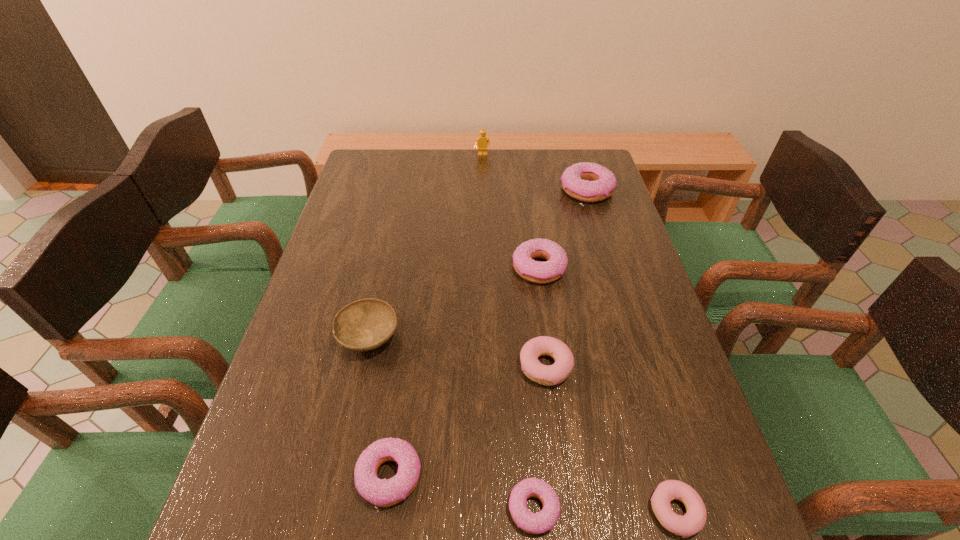
The image size is (960, 540). Find the location of `vacant space at the right edge of the desktop`. vacant space at the right edge of the desktop is located at coordinates (610, 325).

The height and width of the screenshot is (540, 960). Identify the location of free region at the far left corner of the desktop. (366, 182).

In the image, there is a desktop. Where is `vacant space at the far right corner`? This screenshot has width=960, height=540. vacant space at the far right corner is located at coordinates (597, 159).

At what (x,y) coordinates should I click in order to perform the action: click on free space between the right pink doughnut and the gray bowl. Please return your answer as a coordinate pair (x, y). The image size is (960, 540). Looking at the image, I should click on (522, 424).

Where is `free space between the second biggest purple doughnut and the farthest object`? free space between the second biggest purple doughnut and the farthest object is located at coordinates [x=511, y=211].

At what (x,y) coordinates should I click in order to perform the action: click on free spot between the leftmost purple doughnut and the third farthest object. Please return your answer as a coordinate pair (x, y). Looking at the image, I should click on (465, 372).

At what (x,y) coordinates should I click in order to perform the action: click on vacant area between the biggest purple doughnut and the third smallest purple doughnut. Please return your answer as a coordinate pair (x, y). This screenshot has height=540, width=960. Looking at the image, I should click on (564, 229).

Where is `free space between the bigger pink doughnut and the smaller pink doughnut`? The width and height of the screenshot is (960, 540). free space between the bigger pink doughnut and the smaller pink doughnut is located at coordinates (611, 438).

Locate an element on the screen. This screenshot has width=960, height=540. free space between the third smallest purple doughnut and the bigger pink doughnut is located at coordinates [x=542, y=317].

The image size is (960, 540). Find the location of `vacant space in between the sixth nearest object and the right pink doughnut`. vacant space in between the sixth nearest object and the right pink doughnut is located at coordinates (607, 389).